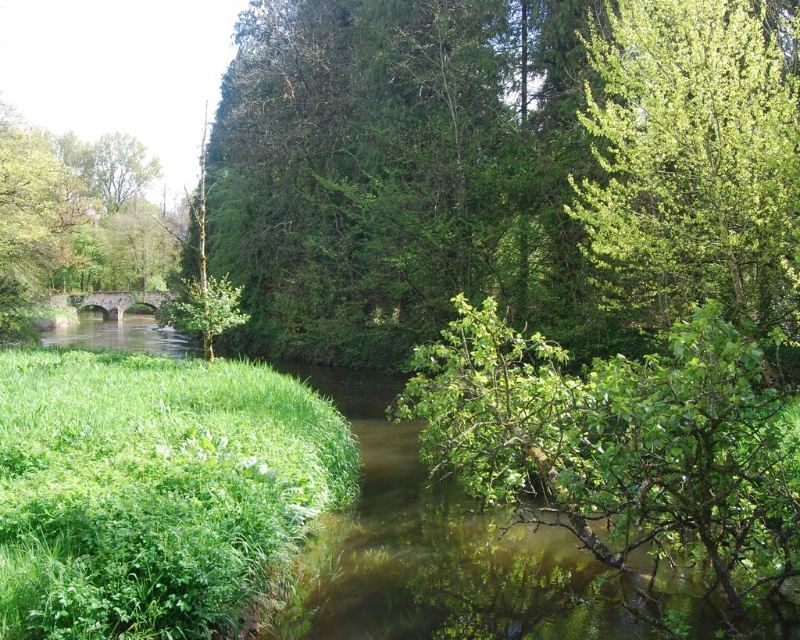
You are standing at the point closer to the camera between the two points, point (282, 81) and point (678, 314). Which point are you standing at?

You are standing at point (282, 81) because it is further to the camera than point (678, 314).

You are standing at the point marked by the coordinates point (x=400, y=173) in the image. What object is directly in front of you?

The point (x=400, y=173) indicates green leafy tree at upper center, so the object directly in front of you is the green leafy tree at upper center.

You are a bird flying over the serene natural landscape. You see the green leafy tree at upper center and the green leafy tree at upper right. Which tree has a wider spread of branches?

The green leafy tree at upper center has a wider spread of branches than the green leafy tree at upper right.